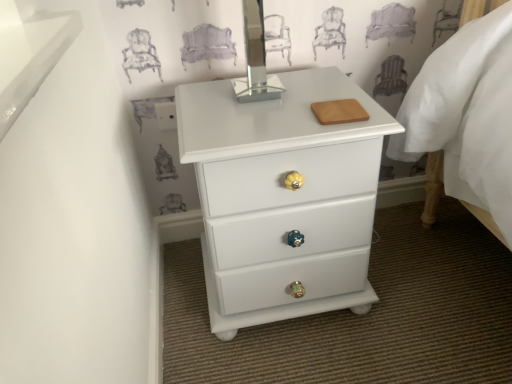
In order to click on free location above white glossy chest of drawers at center (from a real-world perspective) in this screenshot , I will do `click(279, 103)`.